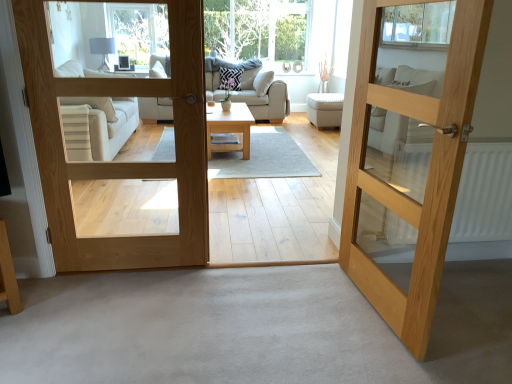
Question: From a real-world perspective, does clear glass window at upper center sit lower than white fabric ottoman at center?

Choices:
 (A) no
 (B) yes

Answer: (A)

Question: Is clear glass window at upper center positioned with its back to white fabric ottoman at center?

Choices:
 (A) no
 (B) yes

Answer: (A)

Question: Is clear glass window at upper center further to camera compared to white fabric ottoman at center?

Choices:
 (A) no
 (B) yes

Answer: (B)

Question: Is clear glass window at upper center wider than white fabric ottoman at center?

Choices:
 (A) yes
 (B) no

Answer: (B)

Question: Could white fabric ottoman at center be considered to be inside clear glass window at upper center?

Choices:
 (A) yes
 (B) no

Answer: (B)

Question: Is clear glass window at upper center thinner than white fabric ottoman at center?

Choices:
 (A) yes
 (B) no

Answer: (A)

Question: Are natural wood door at center, marked as the 1th door in a left-to-right arrangement, and beige fabric studio couch at center located far from each other?

Choices:
 (A) yes
 (B) no

Answer: (A)

Question: Are natural wood door at center, marked as the 1th door in a left-to-right arrangement, and beige fabric studio couch at center beside each other?

Choices:
 (A) yes
 (B) no

Answer: (B)

Question: Is natural wood door at center, marked as the 1th door in a left-to-right arrangement, oriented away from beige fabric studio couch at center?

Choices:
 (A) yes
 (B) no

Answer: (A)

Question: Would you say natural wood door at center, marked as the 1th door in a left-to-right arrangement, contains beige fabric studio couch at center?

Choices:
 (A) no
 (B) yes

Answer: (A)

Question: Considering the relative sizes of natural wood door at center, marked as the 1th door in a left-to-right arrangement, and beige fabric studio couch at center in the image provided, is natural wood door at center, marked as the 1th door in a left-to-right arrangement, wider than beige fabric studio couch at center?

Choices:
 (A) no
 (B) yes

Answer: (A)

Question: From the image's perspective, is natural wood door at center, marked as the second door in a right-to-left arrangement, on beige fabric studio couch at center?

Choices:
 (A) no
 (B) yes

Answer: (A)

Question: Can you confirm if light wood coffee table at center is positioned to the right of beige fabric studio couch at center?

Choices:
 (A) yes
 (B) no

Answer: (A)